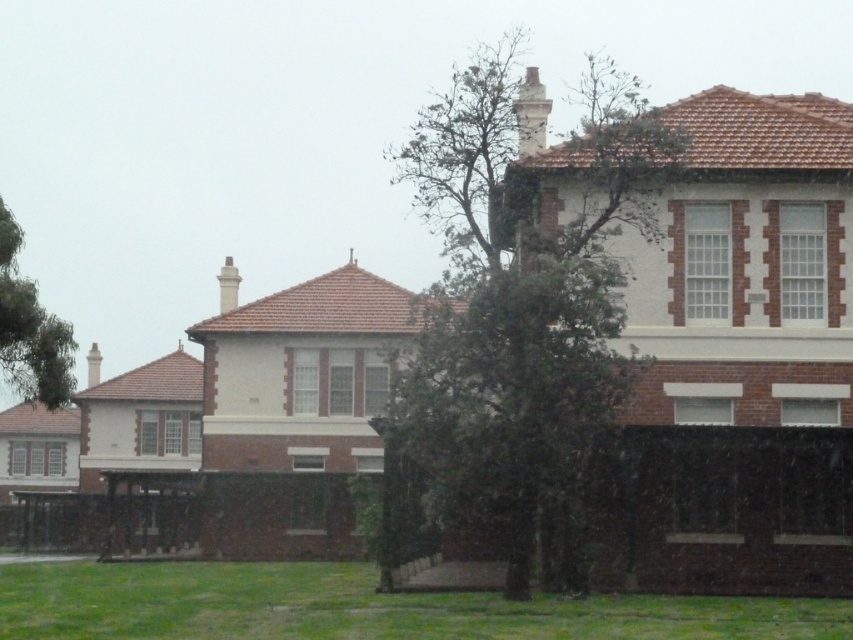
You are a drone operator planning to fly a drone over the residential area. You notice two green leafy trees in the image. Which tree, the green leafy tree at center or the green leafy tree at upper left, is positioned higher in the scene?

The green leafy tree at center is positioned higher in the scene than the green leafy tree at upper left because it is above it.

You are a gardener who needs to water the green grass at lower center and the green leafy tree at upper left. Your watering can holds enough water to cover 10 meters. Can you water both without refilling?

The distance between the green grass at lower center and the green leafy tree at upper left is 9.94 meters, which is within the watering can capacity of 10 meters. Therefore, you can water both without needing to refill.

You are standing at a point in the residential area and want to determine the relative positions of two points marked in the image. Which point is closer to you, point (503, 262) or point (57, 340)?

Point (503, 262) is in front of point (57, 340), so it is closer to you.